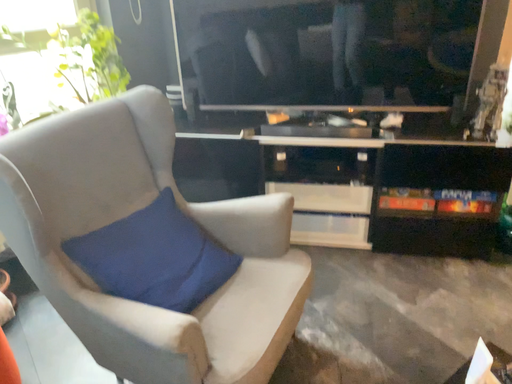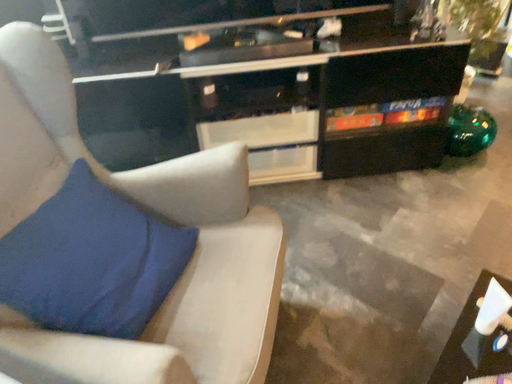
Question: Which way did the camera rotate in the video?

Choices:
 (A) rotated left
 (B) rotated right

Answer: (B)